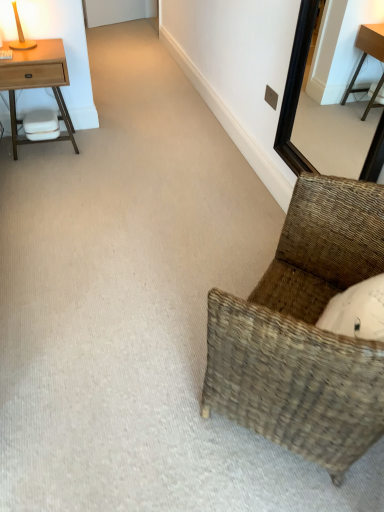
Question: Can you confirm if woven brown chair at lower right is wider than black wooden mirror at upper right?

Choices:
 (A) yes
 (B) no

Answer: (A)

Question: From a real-world perspective, is woven brown chair at lower right positioned under black wooden mirror at upper right based on gravity?

Choices:
 (A) yes
 (B) no

Answer: (A)

Question: Can you confirm if woven brown chair at lower right is smaller than black wooden mirror at upper right?

Choices:
 (A) no
 (B) yes

Answer: (A)

Question: Are woven brown chair at lower right and black wooden mirror at upper right located far from each other?

Choices:
 (A) no
 (B) yes

Answer: (B)

Question: From the image's perspective, is woven brown chair at lower right beneath black wooden mirror at upper right?

Choices:
 (A) no
 (B) yes

Answer: (B)

Question: Does point (13, 56) appear closer or farther from the camera than point (21, 41)?

Choices:
 (A) farther
 (B) closer

Answer: (B)

Question: From a real-world perspective, relative to matte wooden table lamp at upper left, is light wood nightstand at left vertically above or below?

Choices:
 (A) above
 (B) below

Answer: (B)

Question: In the image, is light wood nightstand at left positioned in front of or behind matte wooden table lamp at upper left?

Choices:
 (A) behind
 (B) front

Answer: (A)

Question: In terms of size, does light wood nightstand at left appear bigger or smaller than matte wooden table lamp at upper left?

Choices:
 (A) small
 (B) big

Answer: (B)

Question: In terms of height, does black wooden mirror at upper right look taller or shorter compared to woven brown chair at lower right?

Choices:
 (A) tall
 (B) short

Answer: (A)

Question: From a real-world perspective, relative to woven brown chair at lower right, is black wooden mirror at upper right vertically above or below?

Choices:
 (A) above
 (B) below

Answer: (A)

Question: Looking at the image, does black wooden mirror at upper right seem bigger or smaller compared to woven brown chair at lower right?

Choices:
 (A) small
 (B) big

Answer: (A)

Question: Does point (374, 137) appear closer or farther from the camera than point (292, 388)?

Choices:
 (A) farther
 (B) closer

Answer: (A)

Question: From a real-world perspective, is black wooden mirror at upper right physically located above or below matte wooden table lamp at upper left?

Choices:
 (A) below
 (B) above

Answer: (A)

Question: From the image's perspective, is black wooden mirror at upper right located above or below matte wooden table lamp at upper left?

Choices:
 (A) above
 (B) below

Answer: (B)